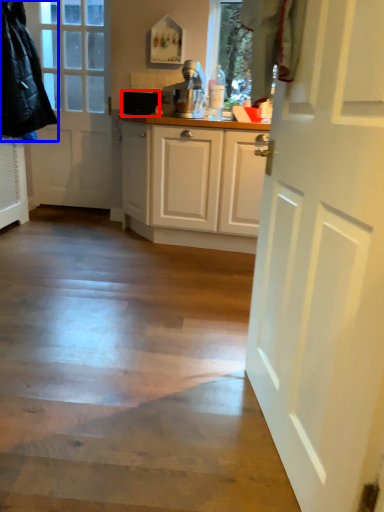
Question: Which of the following is the closest to the observer, appliance (highlighted by a red box) or jacket (highlighted by a blue box)?

Choices:
 (A) appliance
 (B) jacket

Answer: (B)